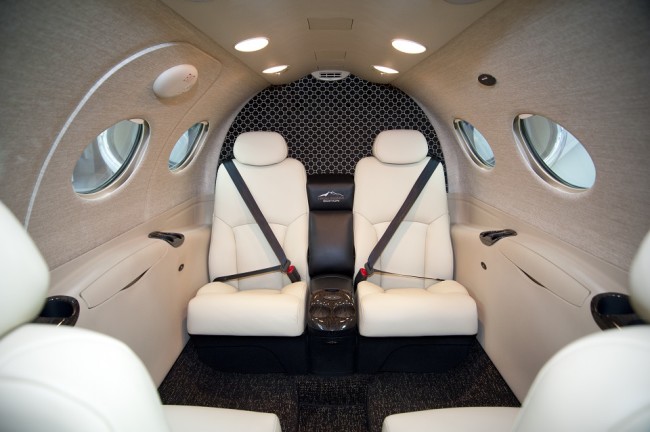
Locate an element on the screen. This screenshot has height=432, width=650. floor is located at coordinates (434, 377).